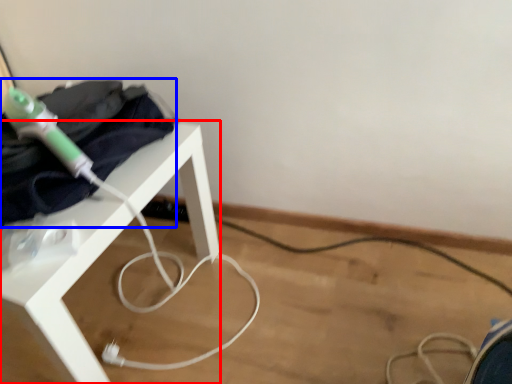
Question: Which point is further to the camera, table (highlighted by a red box) or clothing (highlighted by a blue box)?

Choices:
 (A) table
 (B) clothing

Answer: (B)